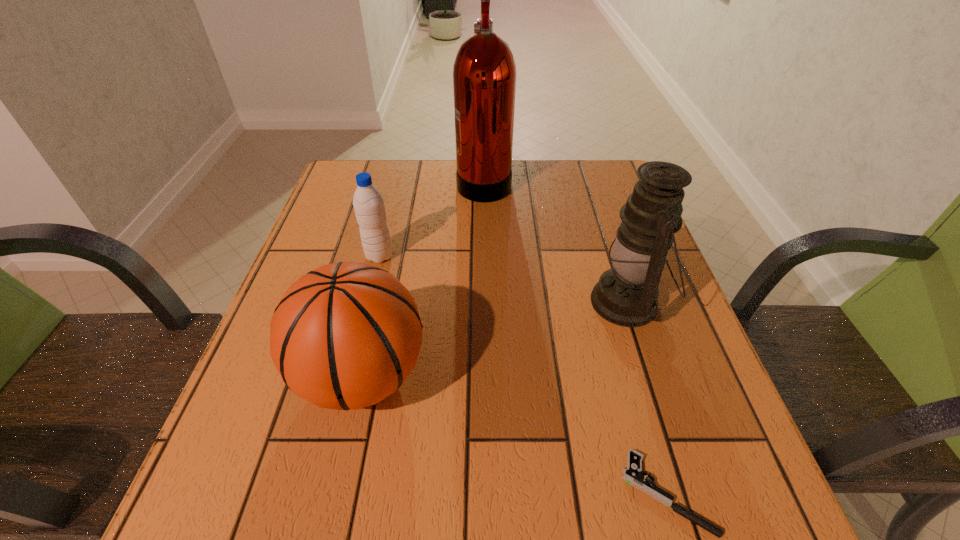
Where is `free space that satisfies the following two spatial constraints: 1. on the front side of the fourth shortest object; 2. on the front-facing side of the shortest object`? The width and height of the screenshot is (960, 540). free space that satisfies the following two spatial constraints: 1. on the front side of the fourth shortest object; 2. on the front-facing side of the shortest object is located at coordinates (689, 493).

Where is `vacant region that satisfies the following two spatial constraints: 1. on the front side of the water bottle; 2. on the right side of the basketball`? vacant region that satisfies the following two spatial constraints: 1. on the front side of the water bottle; 2. on the right side of the basketball is located at coordinates (349, 376).